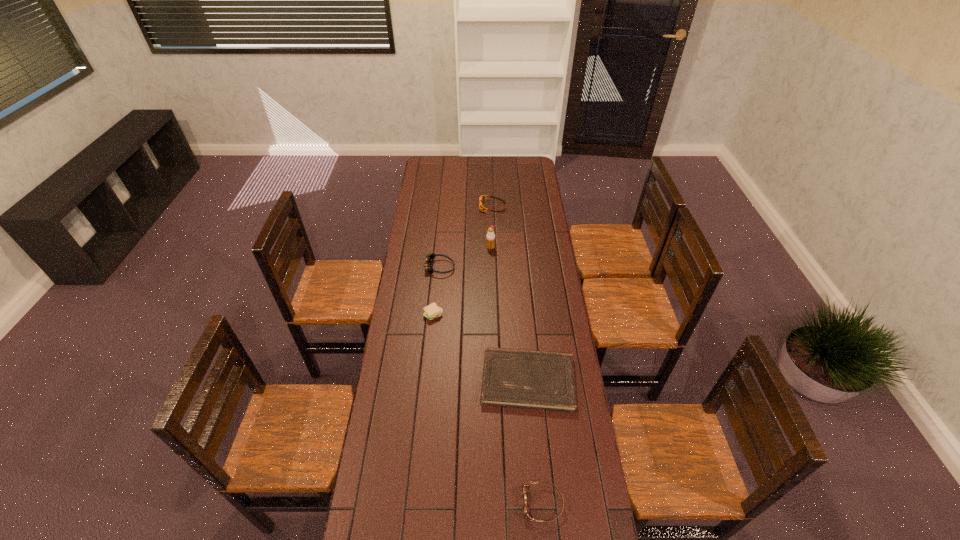
This screenshot has width=960, height=540. I want to click on icecream, so click(490, 236).

This screenshot has width=960, height=540. Find the location of `the second farthest object`. the second farthest object is located at coordinates (490, 236).

Identify the location of the tallest goggles. This screenshot has height=540, width=960. coord(429,258).

At what (x,y) coordinates should I click in order to perform the action: click on the fifth shortest object. Please return your answer as a coordinate pair (x, y). This screenshot has width=960, height=540. Looking at the image, I should click on (429, 258).

Identify the location of the farthest object. The width and height of the screenshot is (960, 540). (481, 199).

At what (x,y) coordinates should I click in order to perform the action: click on the third nearest object. Please return your answer as a coordinate pair (x, y). Looking at the image, I should click on (432, 311).

Where is `the nearest object`? the nearest object is located at coordinates (526, 509).

Identify the location of paperback book. The width and height of the screenshot is (960, 540). (545, 380).

Identify the location of the shortest object. The width and height of the screenshot is (960, 540). (545, 380).

You are a GUI agent. You are given a task and a screenshot of the screen. Output one action in this format:
    pyautogui.click(x=<x>, y=<y>)
    Task: Click on the vacant region located at the front with a straw on the icecream
    This screenshot has width=960, height=540.
    Given the screenshot: What is the action you would take?
    pyautogui.click(x=492, y=279)